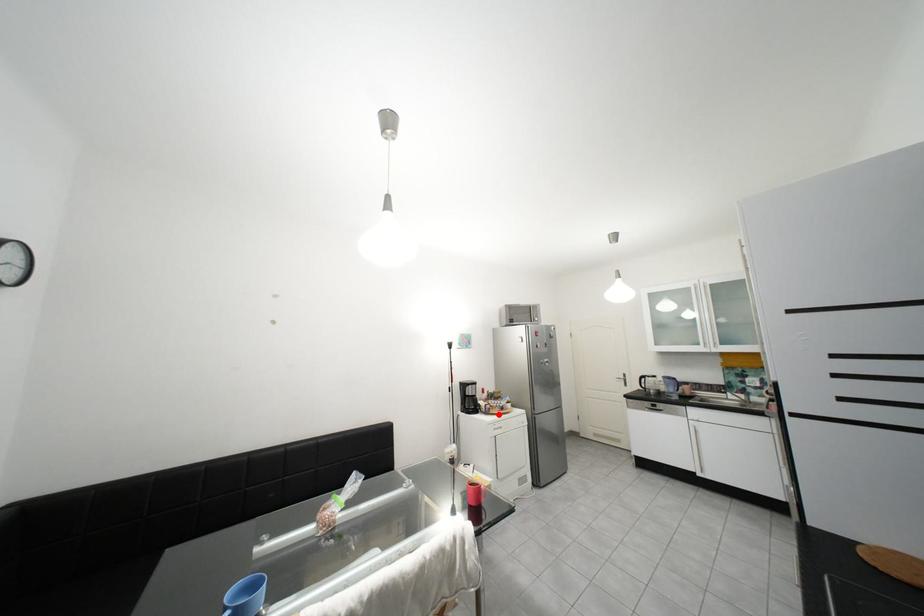
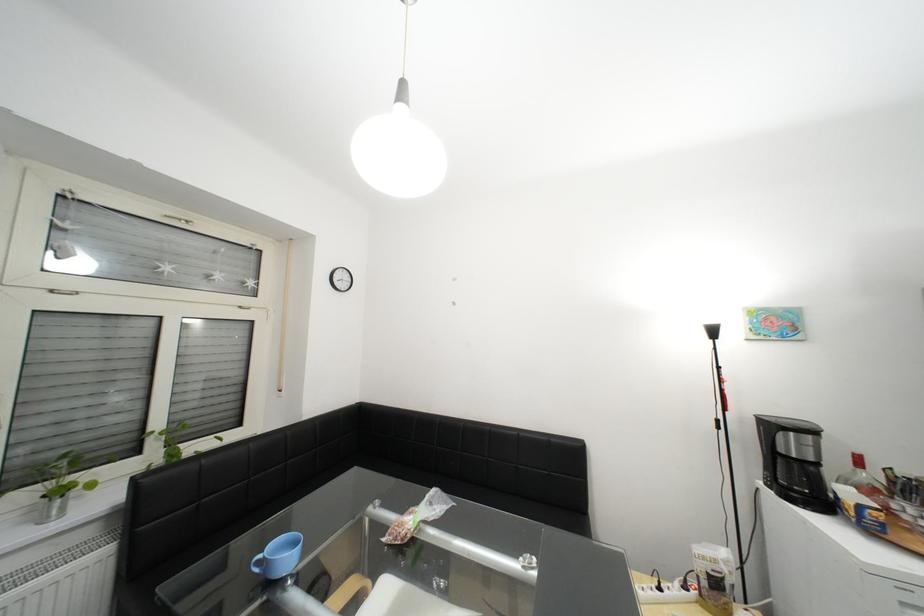
In the second image, find the point that corresponds to the highlighted location in the first image.

(886, 533)